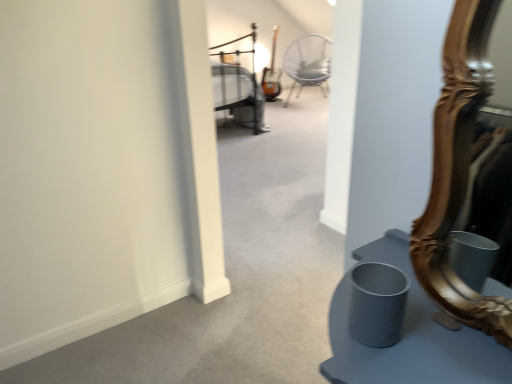
At what (x,y) coordinates should I click in order to perform the action: click on gold carved mirror at right. Please return your answer as a coordinate pair (x, y). Image resolution: width=512 pixels, height=384 pixels. Looking at the image, I should click on (458, 171).

Locate an element on the screen. metallic silver bed at upper center is located at coordinates [x=238, y=82].

What do you see at coordinates (308, 63) in the screenshot?
I see `metallic silver chair at center` at bounding box center [308, 63].

Identify the location of gold carved mirror at right. (458, 171).

From a real-world perspective, does metallic silver chair at center sit lower than gold carved mirror at right?

Indeed, from a real-world perspective, metallic silver chair at center is positioned beneath gold carved mirror at right.

What are the coordinates of `mirror in front of the metallic silver chair at center` in the screenshot? It's located at (458, 171).

How many degrees apart are the facing directions of metallic silver chair at center and gold carved mirror at right?

They differ by 134 degrees in their facing directions.

Is metallic silver chair at center completely or partially outside of gold carved mirror at right?

Absolutely, metallic silver chair at center is external to gold carved mirror at right.

Considering the sizes of objects gold carved mirror at right and metallic silver bed at upper center in the image provided, who is taller, gold carved mirror at right or metallic silver bed at upper center?

With more height is metallic silver bed at upper center.

Considering the relative positions of gold carved mirror at right and metallic silver bed at upper center in the image provided, is gold carved mirror at right to the left or to the right of metallic silver bed at upper center?

Clearly, gold carved mirror at right is on the right of metallic silver bed at upper center in the image.

Could you tell me if gold carved mirror at right is facing metallic silver bed at upper center?

Yes, gold carved mirror at right is aimed at metallic silver bed at upper center.

Choose the correct answer: Is gold carved mirror at right inside metallic silver bed at upper center or outside it?

gold carved mirror at right cannot be found inside metallic silver bed at upper center.

Does point (223, 69) come behind point (297, 51)?

No, (223, 69) is closer to viewer.

Consider the image. Would you say metallic silver bed at upper center contains metallic silver chair at center?

No, metallic silver chair at center is not a part of metallic silver bed at upper center.

Considering the relative positions of metallic silver bed at upper center and metallic silver chair at center in the image provided, is metallic silver bed at upper center behind metallic silver chair at center?

No, metallic silver bed at upper center is closer to the viewer.

From the image's perspective, between metallic silver bed at upper center and metallic silver chair at center, who is located below?

metallic silver bed at upper center appears lower in the image.

Consider the image. From a real-world perspective, which object stands above the other?

From a 3D spatial view, metallic silver bed at upper center is above.

Can we say metallic silver chair at center lies outside metallic silver bed at upper center?

Yes, metallic silver chair at center is outside of metallic silver bed at upper center.

In the image, there is a metallic silver chair at center. Where is `bed below it (from the image's perspective)`? The height and width of the screenshot is (384, 512). bed below it (from the image's perspective) is located at coordinates (238, 82).

Looking at this image, does metallic silver chair at center come behind metallic silver bed at upper center?

Yes, metallic silver chair at center is further from the camera.

From the picture: Is gold carved mirror at right with metallic silver chair at center?

No, gold carved mirror at right is not making contact with metallic silver chair at center.

Can you confirm if gold carved mirror at right is shorter than metallic silver chair at center?

No.

From the image's perspective, is gold carved mirror at right on top of metallic silver chair at center?

No, from the image's perspective, gold carved mirror at right is not over metallic silver chair at center.

How different are the orientations of gold carved mirror at right and metallic silver chair at center in degrees?

134 degrees.

Is metallic silver bed at upper center beside gold carved mirror at right?

No, metallic silver bed at upper center is not next to gold carved mirror at right.

Considering the positions of objects metallic silver bed at upper center and gold carved mirror at right in the image provided, who is more to the left, metallic silver bed at upper center or gold carved mirror at right?

Positioned to the left is metallic silver bed at upper center.

Which point is more forward, [214,90] or [475,89]?

Point [475,89]

From the image's perspective, which one is positioned lower, metallic silver bed at upper center or gold carved mirror at right?

gold carved mirror at right, from the image's perspective.

Locate an element on the screen. The image size is (512, 384). mirror lying in front of the metallic silver chair at center is located at coordinates (458, 171).

The image size is (512, 384). Find the location of `mirror that is on the right side of metallic silver bed at upper center`. mirror that is on the right side of metallic silver bed at upper center is located at coordinates (458, 171).

When comparing their distances from metallic silver chair at center, does metallic silver bed at upper center or gold carved mirror at right seem closer?

metallic silver bed at upper center.

Looking at the image, which one is located further to metallic silver bed at upper center, gold carved mirror at right or metallic silver chair at center?

Based on the image, gold carved mirror at right appears to be further to metallic silver bed at upper center.

Which object lies nearer to the anchor point metallic silver bed at upper center, metallic silver chair at center or gold carved mirror at right?

metallic silver chair at center.

Based on their spatial positions, is metallic silver chair at center or metallic silver bed at upper center closer to gold carved mirror at right?

metallic silver bed at upper center is positioned closer to the anchor gold carved mirror at right.

Looking at the image, which one is located further to gold carved mirror at right, metallic silver bed at upper center or metallic silver chair at center?

metallic silver chair at center.

Which object lies nearer to the anchor point metallic silver chair at center, gold carved mirror at right or metallic silver bed at upper center?

Based on the image, metallic silver bed at upper center appears to be nearer to metallic silver chair at center.

Find the location of `bed between gold carved mirror at right and metallic silver chair at center in the front-back direction`. bed between gold carved mirror at right and metallic silver chair at center in the front-back direction is located at coordinates (238, 82).